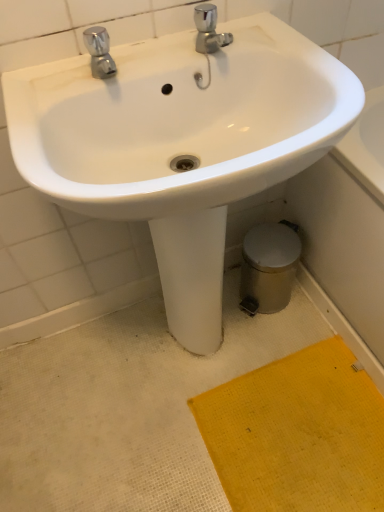
Where is `free space in front of polished chrome faucet at upper left`? The width and height of the screenshot is (384, 512). free space in front of polished chrome faucet at upper left is located at coordinates (64, 108).